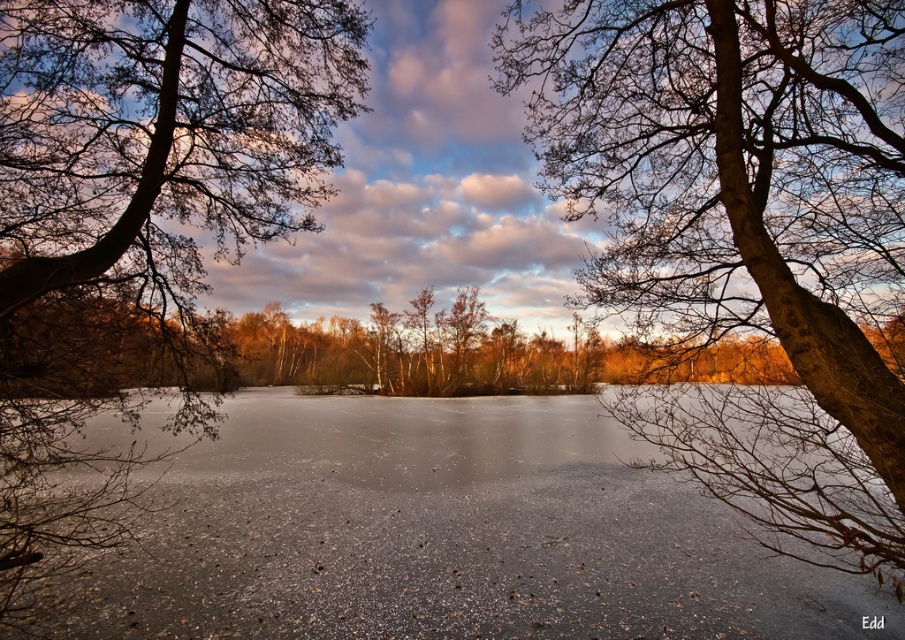
I want to click on brown rough bark tree at upper right, so click(745, 236).

Between point (631, 294) and point (26, 424), which one is positioned behind?

The point (631, 294) is behind.

Locate an element on the screen. brown rough bark tree at upper right is located at coordinates (745, 236).

You are a GUI agent. You are given a task and a screenshot of the screen. Output one action in this format:
    pyautogui.click(x=<x>, y=<y>)
    Task: Click on the brown rough bark tree at upper right
    The width and height of the screenshot is (905, 640).
    Given the screenshot: What is the action you would take?
    pyautogui.click(x=745, y=236)